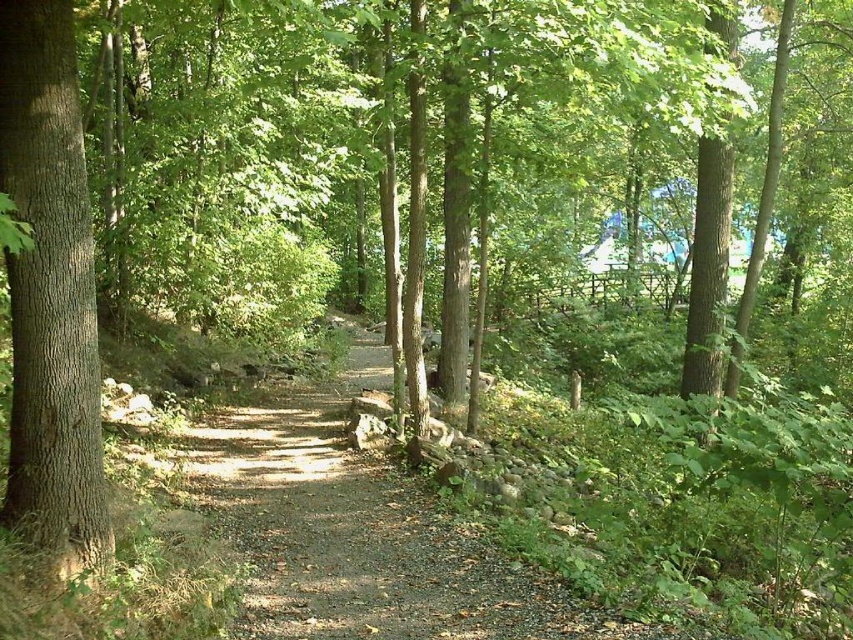
You are a hiker standing at the starting point of the dirt path at center. You want to reach a cabin located at coordinate point 0.833, 0.422. Can you directly walk straight ahead to reach it?

The dirt path at center is located at coordinate point (x=358, y=532), so yes, you can directly walk straight ahead along the dirt path at center to reach the cabin at that coordinate.